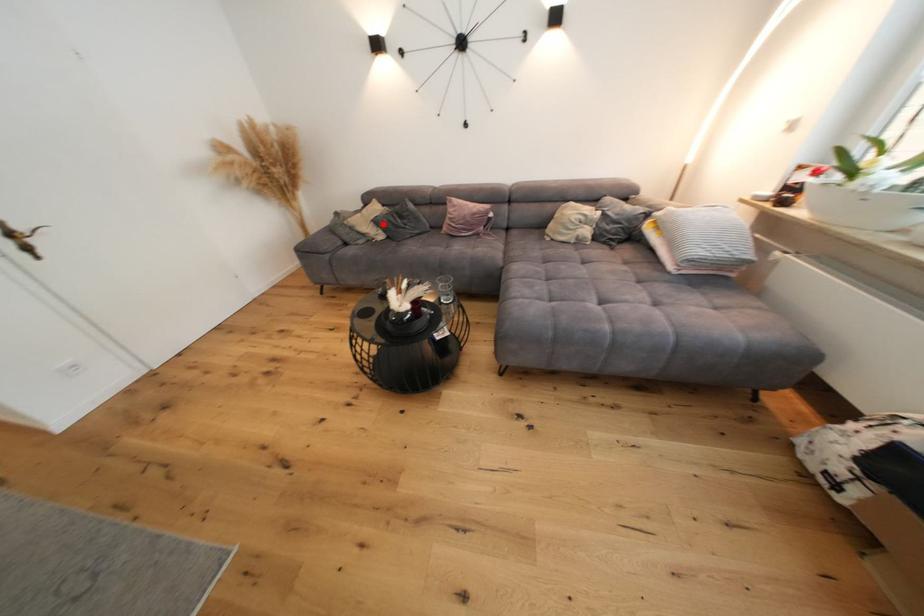
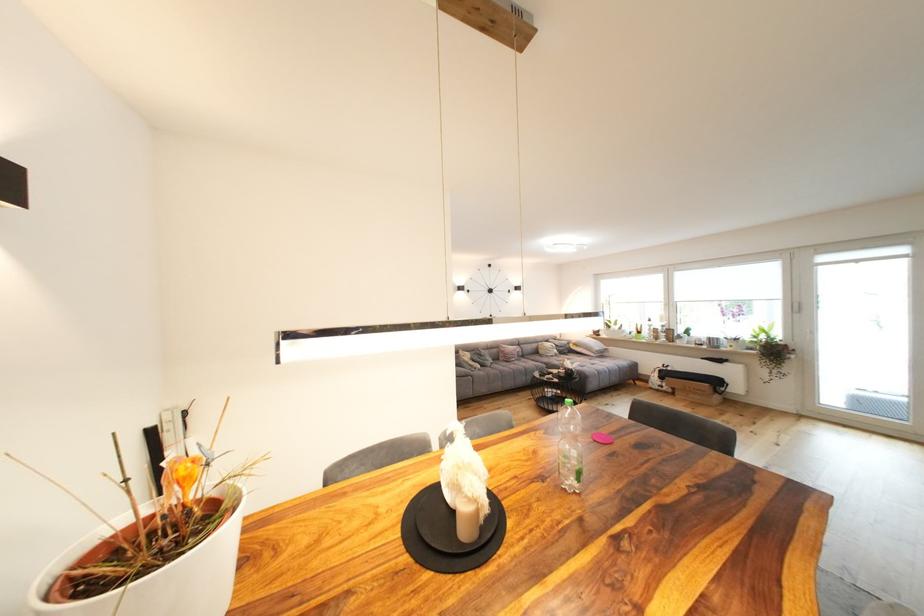
Question: I am providing you with two images of the same scene from different viewpoints. A red point is shown in image1. For the corresponding object point in image2, is it positioned nearer or farther from the camera?

Choices:
 (A) Nearer
 (B) Farther

Answer: (B)